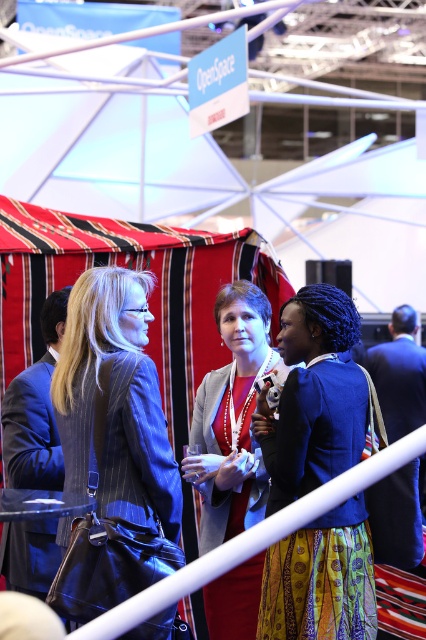
You are navigating through the event hall and want to move from point A to point B. Point A is at coordinates point (x=267, y=552) and point B is at coordinates point (x=224, y=429). Given the scene description, which direction should you move to go from point A to point B?

Since point (x=267, y=552) is in front of point (x=224, y=429), you should move backward to reach point B from point A.

You are an event organizer at the conference. You need to arrange a photo shoot where the blue pinstripe blazer at center and the blue fabric jacket at center must be visible. Which one should be placed higher to ensure both are visible in the photo?

The blue pinstripe blazer at center should be placed higher than the blue fabric jacket at center to ensure both are visible in the photo since the blue pinstripe blazer at center is above the blue fabric jacket at center.